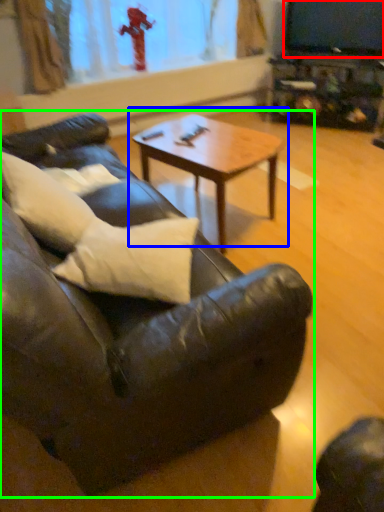
Question: Which object is positioned farthest from television (highlighted by a red box)? Select from coffee table (highlighted by a blue box) and studio couch (highlighted by a green box).

Choices:
 (A) coffee table
 (B) studio couch

Answer: (B)